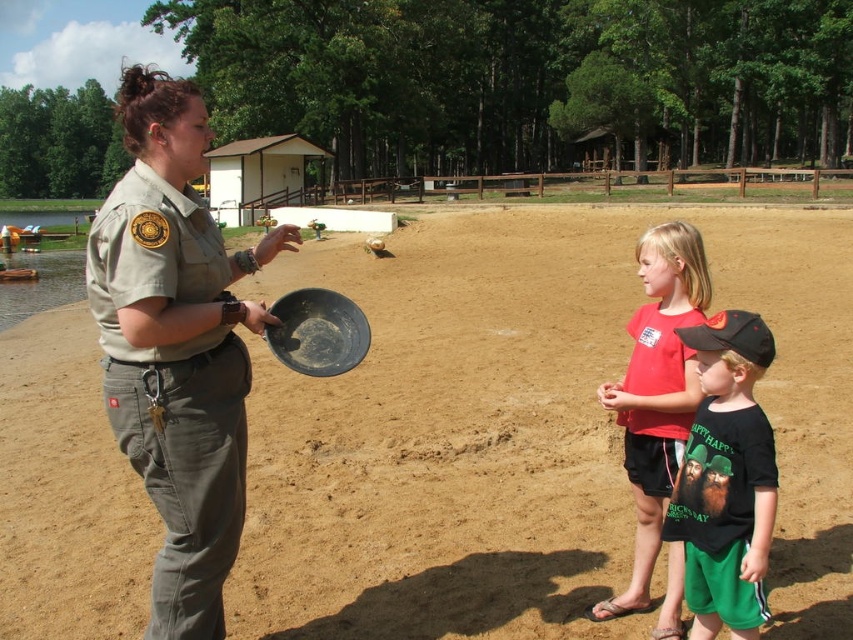
You are a photographer trying to capture a closeup of the green cotton shorts at lower right and the red cotton shirt at center. Which object should you zoom in on first to ensure it fits better in your frame?

The red cotton shirt at center should be zoomed in on first because it occupies more space than the green cotton shorts at lower right, making it easier to frame properly.

Looking at this image, you are a visitor at the park and want to find the green cotton shorts at lower right. According to the scene, where should you look relative to the brown sandy dirt at center?

The green cotton shorts at lower right are located to the right side of the brown sandy dirt at center.